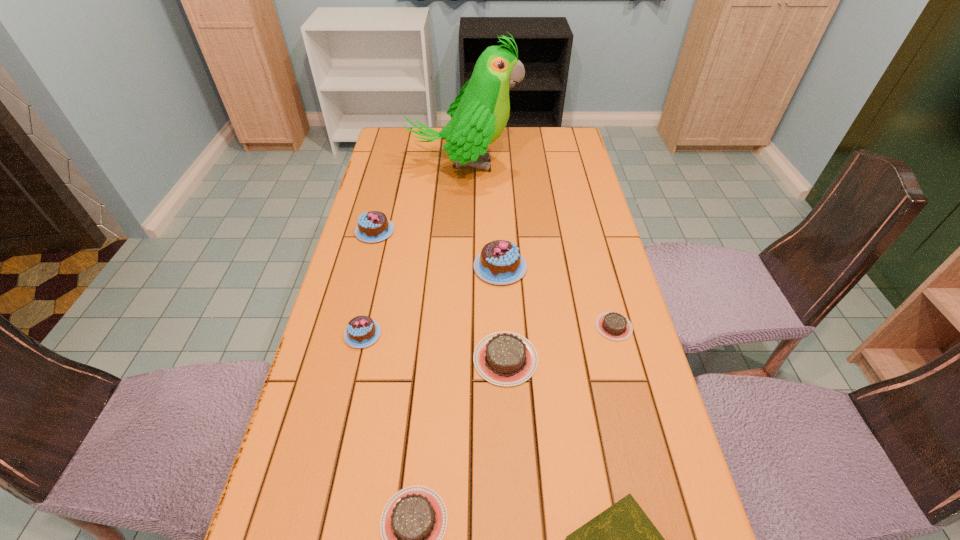
This screenshot has width=960, height=540. I want to click on parakeet, so click(479, 114).

Locate an element on the screen. green parakeet is located at coordinates (479, 114).

Find the location of `the second farthest chocolate cake`. the second farthest chocolate cake is located at coordinates (500, 262).

This screenshot has width=960, height=540. What are the coordinates of `the second tallest object` in the screenshot? It's located at (500, 262).

This screenshot has width=960, height=540. Find the location of `the second smallest pink chocolate cake`. the second smallest pink chocolate cake is located at coordinates (373, 226).

The height and width of the screenshot is (540, 960). What are the coordinates of `the second farthest object` in the screenshot? It's located at (373, 226).

Identify the location of the smallest pink chocolate cake. This screenshot has height=540, width=960. (362, 331).

The height and width of the screenshot is (540, 960). I want to click on the nearest pink chocolate cake, so click(362, 331).

Find the location of `the third shortest chocolate cake`. the third shortest chocolate cake is located at coordinates (504, 358).

In order to click on the fourth shortest object in this screenshot , I will do `click(504, 358)`.